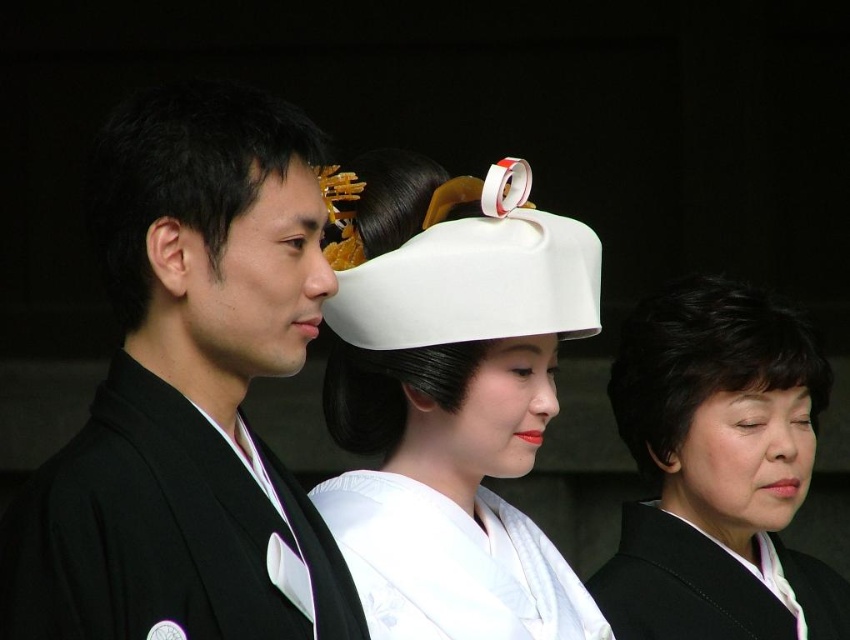
Is black silk kimono at left shorter than black matte kimono at right?

No, black silk kimono at left is not shorter than black matte kimono at right.

Does point (238, 161) come closer to viewer compared to point (833, 604)?

Yes.

Does point (140, 104) come farther from viewer compared to point (820, 632)?

No, (140, 104) is in front of (820, 632).

Locate an element on the screen. Image resolution: width=850 pixels, height=640 pixels. black silk kimono at left is located at coordinates (187, 392).

Which of these two, white silk kimono at center or black matte hair at left, stands shorter?

With less height is white silk kimono at center.

Who is higher up, white silk kimono at center or black matte hair at left?

black matte hair at left is above.

Between point (422, 532) and point (298, 124), which one is positioned behind?

Positioned behind is point (422, 532).

Locate an element on the screen. The image size is (850, 640). white silk kimono at center is located at coordinates (451, 564).

Who is positioned more to the right, white matte hat at center or white silk kimono at center?

Positioned to the right is white silk kimono at center.

Which is in front, point (518, 342) or point (346, 561)?

Point (346, 561) is more forward.

At what (x,y) coordinates should I click in order to perform the action: click on white matte hat at center. Please return your answer as a coordinate pair (x, y). This screenshot has height=640, width=850. Looking at the image, I should click on (457, 419).